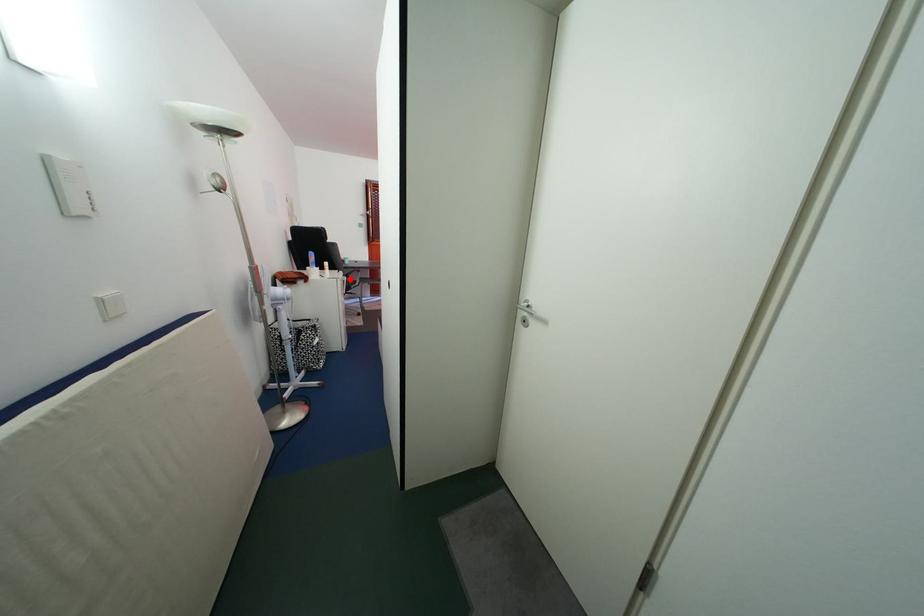
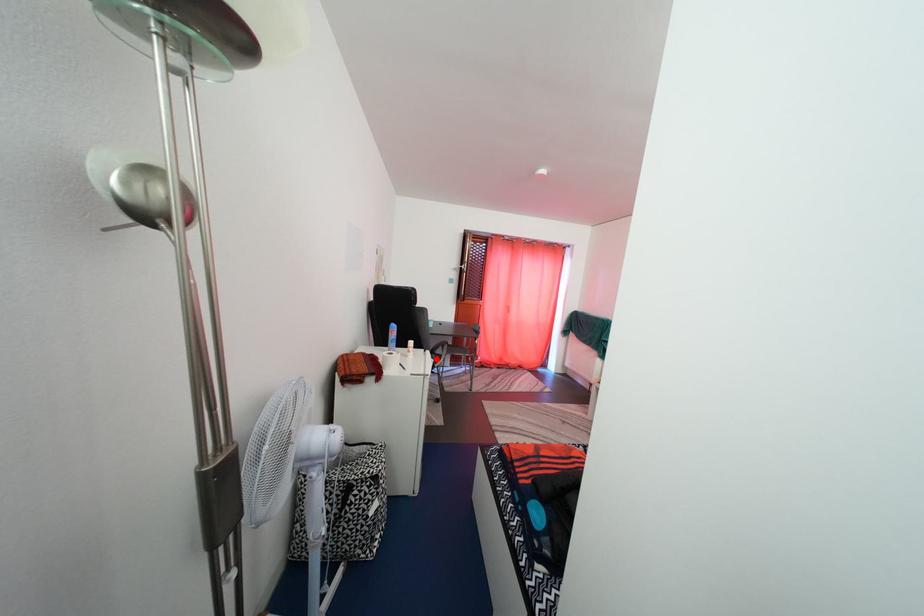
I am providing you with two images of the same scene from different viewpoints. A red point is marked on the first image and another point is marked on the second image. Is the marked point in image1 the same physical position as the marked point in image2?

Yes